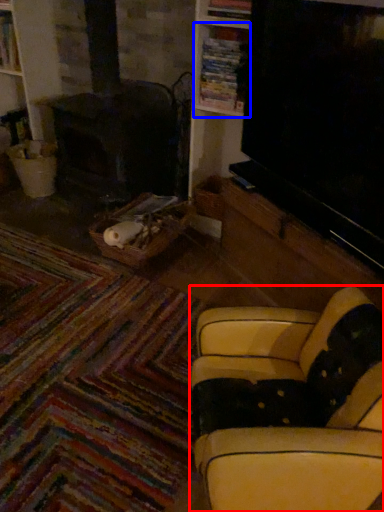
Question: Which of the following is the farthest to the observer, studio couch (highlighted by a red box) or shelf (highlighted by a blue box)?

Choices:
 (A) studio couch
 (B) shelf

Answer: (B)